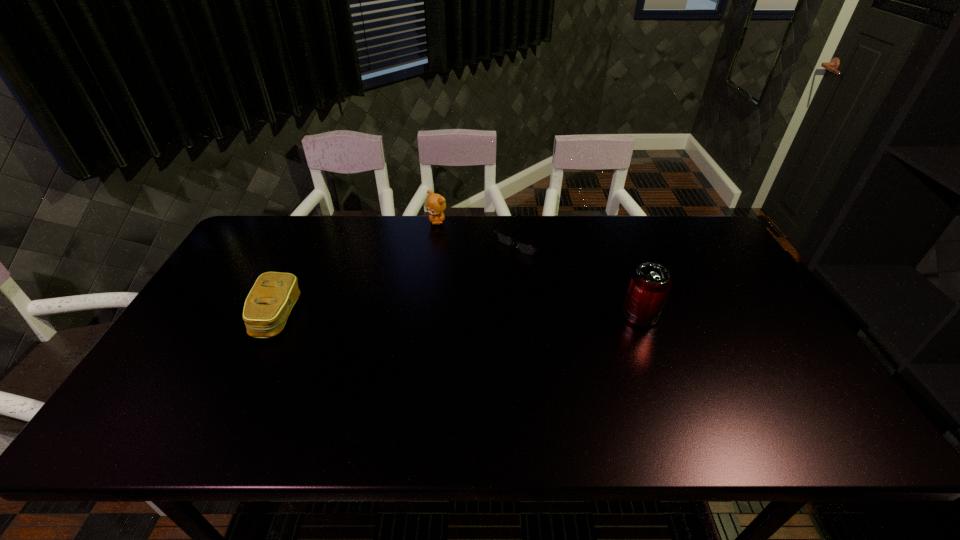
Locate an element on the screen. This screenshot has width=960, height=540. vacant area that lies between the rightmost object and the teddy bear is located at coordinates (539, 269).

At what (x,y) coordinates should I click in order to perform the action: click on free point between the teddy bear and the clutch bag. Please return your answer as a coordinate pair (x, y). This screenshot has height=540, width=960. Looking at the image, I should click on (357, 269).

Locate an element on the screen. free space between the teddy bear and the clutch bag is located at coordinates (357, 269).

Where is `empty space between the clutch bag and the second object from left to right`? The width and height of the screenshot is (960, 540). empty space between the clutch bag and the second object from left to right is located at coordinates (357, 269).

Select which object appears as the second closest to the second object from left to right. Please provide its 2D coordinates. Your answer should be formatted as a tuple, i.e. [(x, y)], where the tuple contains the x and y coordinates of a point satisfying the conditions above.

[(267, 307)]

Identify the location of object that is the second closest one to the clutch bag. (525, 248).

Where is `free space that satisfies the following two spatial constraints: 1. on the front side of the soda can; 2. on the left side of the spectacles`? free space that satisfies the following two spatial constraints: 1. on the front side of the soda can; 2. on the left side of the spectacles is located at coordinates (538, 316).